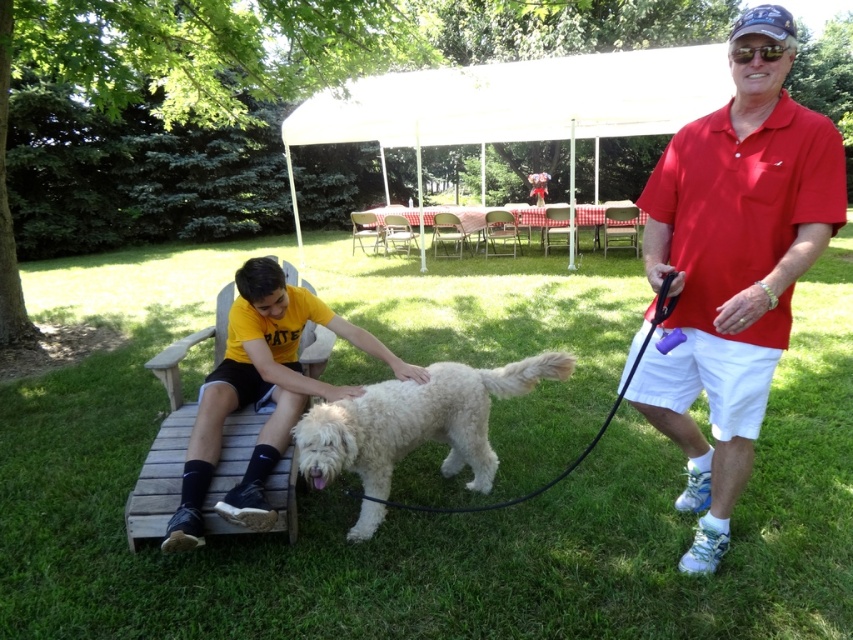
Question: Can you confirm if white fluffy dog at center is bigger than red checkered tablecloth at center?

Choices:
 (A) yes
 (B) no

Answer: (A)

Question: Can you confirm if white fluffy dog at center is smaller than wooden park bench at lower left?

Choices:
 (A) no
 (B) yes

Answer: (B)

Question: Among these points, which one is nearest to the camera?

Choices:
 (A) (338, 440)
 (B) (521, 221)

Answer: (A)

Question: Based on their relative distances, which object is farther from the red checkered tablecloth at center?

Choices:
 (A) red cotton shirt at right
 (B) wooden park bench at lower left

Answer: (A)

Question: Considering the real-world distances, which object is farthest from the black rubber leash at center?

Choices:
 (A) red cotton shirt at right
 (B) wooden park bench at lower left

Answer: (B)

Question: Does wooden park bench at lower left have a lesser width compared to red checkered tablecloth at center?

Choices:
 (A) yes
 (B) no

Answer: (B)